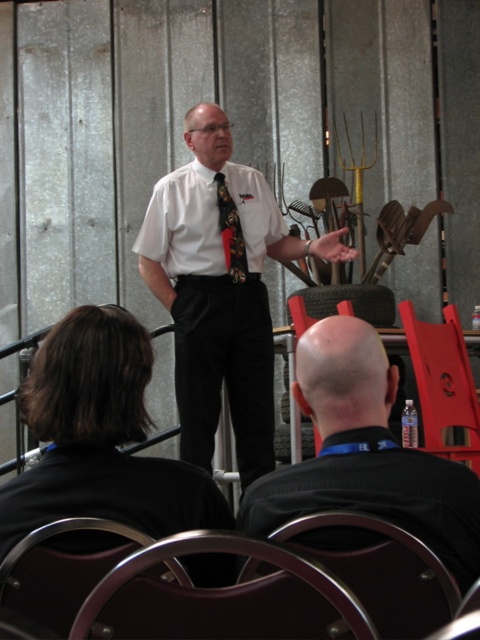
What do you see at coordinates (219, 292) in the screenshot? The height and width of the screenshot is (640, 480). I see `white shirt at center` at bounding box center [219, 292].

Identify the location of white shirt at center. This screenshot has width=480, height=640. (219, 292).

Between point (238, 445) and point (441, 333), which one is positioned behind?

The point (238, 445) is more distant.

Where is `white shirt at center`? The width and height of the screenshot is (480, 640). white shirt at center is located at coordinates (219, 292).

Does metallic silver chair at lower center lie in front of black satin tie at center?

Yes, it is.

Does point (417, 570) lie behind point (228, 257)?

No, (417, 570) is closer to viewer.

You are a GUI agent. You are given a task and a screenshot of the screen. Output one action in this format:
    pyautogui.click(x=<x>, y=<y>)
    Task: Click on the metallic silver chair at lower center
    The height and width of the screenshot is (640, 480).
    Given the screenshot: What is the action you would take?
    pyautogui.click(x=384, y=573)

Who is positioned more to the right, white shirt at center or metallic silver chair at lower center?

metallic silver chair at lower center

Is point (253, 284) positioned after point (445, 618)?

Yes, it is.

Is point (202, 289) positioned after point (298, 518)?

Yes, point (202, 289) is behind point (298, 518).

I want to click on white shirt at center, so click(219, 292).